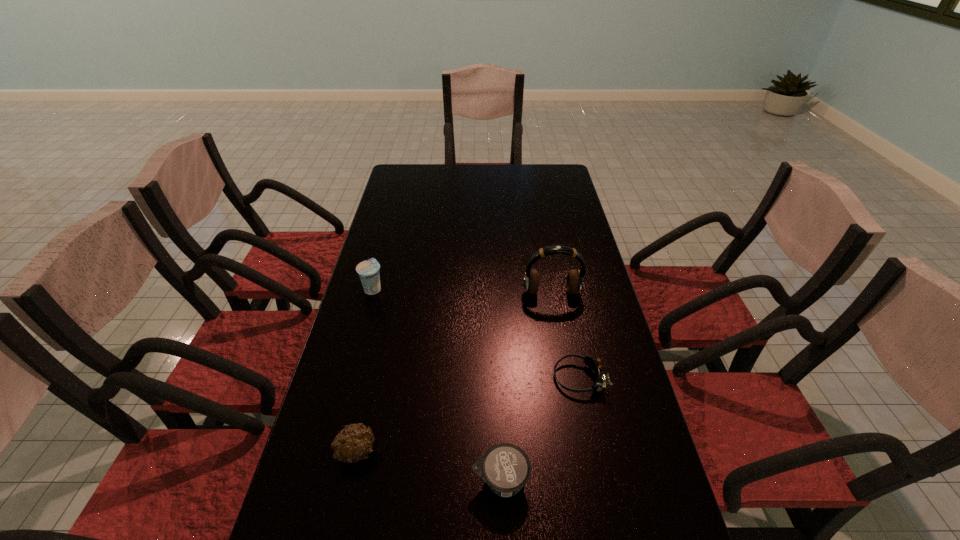
Locate an element on the screen. Image resolution: width=960 pixels, height=540 pixels. free point between the third farthest object and the right yogurt is located at coordinates (540, 429).

Find the location of a particular element. empty location between the headset and the nearer yogurt is located at coordinates (526, 386).

Identify the location of blank region between the third object from left to right and the tallest object. (526, 386).

Locate an element on the screen. The image size is (960, 540). the closest object to the taller yogurt is located at coordinates (574, 282).

This screenshot has width=960, height=540. Find the location of `object that is the third closest to the shorter yogurt`. object that is the third closest to the shorter yogurt is located at coordinates click(574, 282).

At what (x,y) coordinates should I click in order to perform the action: click on vacant point that satisfies the following two spatial constraints: 1. on the front side of the muffin; 2. on the left side of the taller yogurt. Please return your answer as a coordinate pair (x, y). This screenshot has height=540, width=960. Looking at the image, I should click on (329, 451).